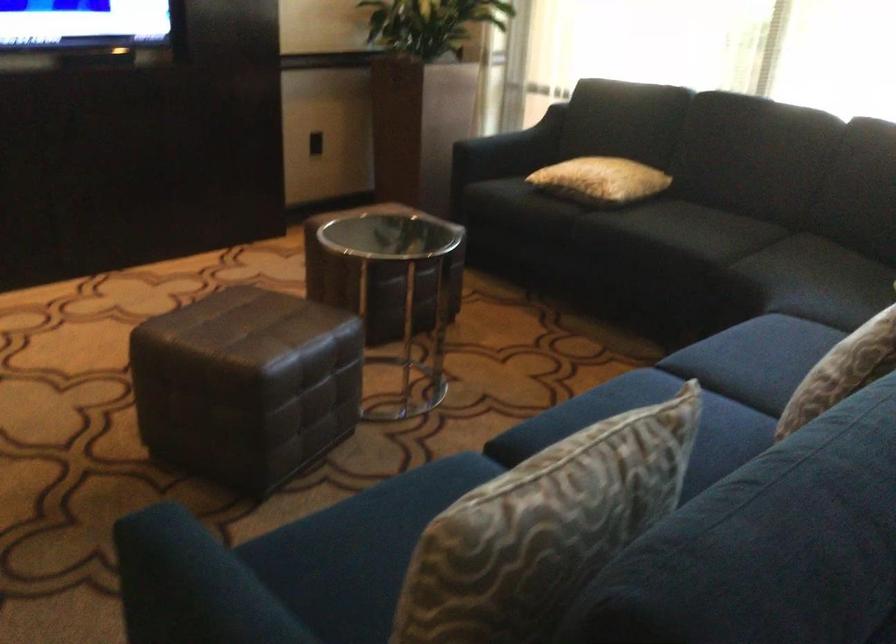
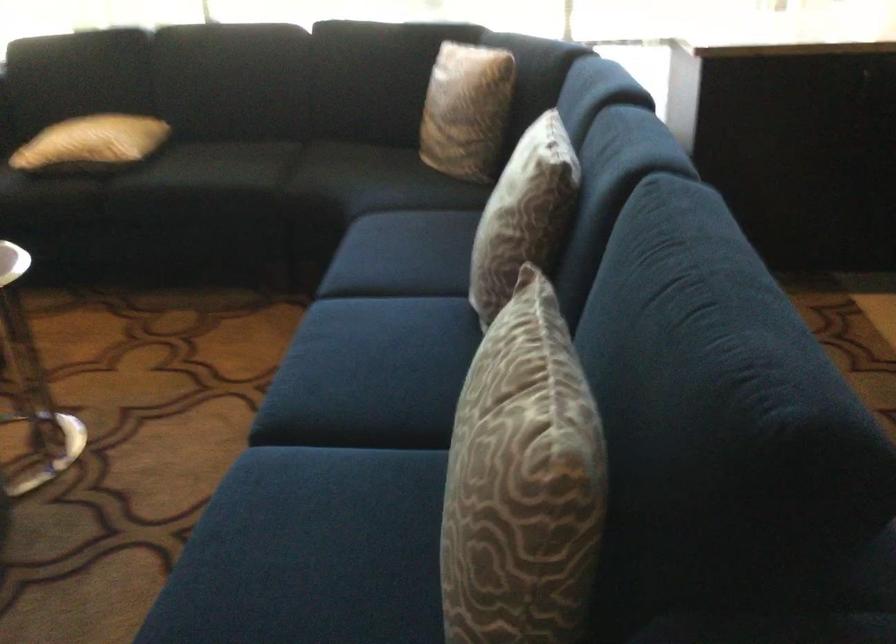
Locate, in the second image, the point that corresponds to (625,111) in the first image.

(82, 64)